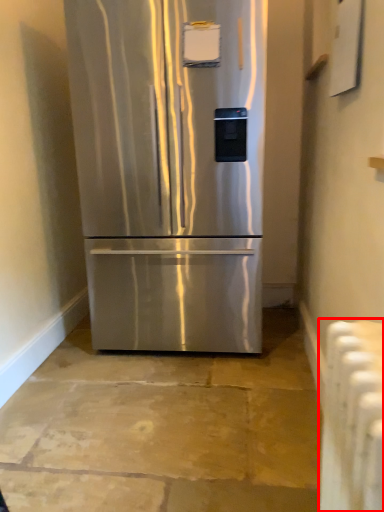
Question: Where is radiator (annotated by the red box) located in relation to refrigerator in the image?

Choices:
 (A) left
 (B) right

Answer: (B)